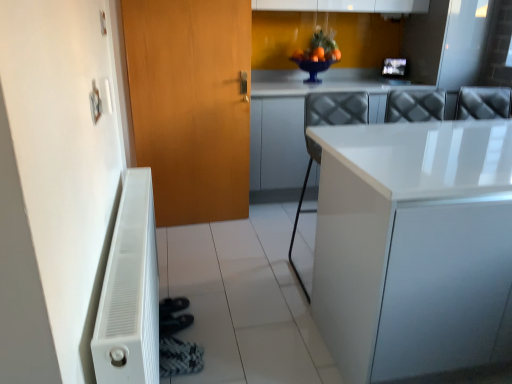
Question: From a real-world perspective, is white glossy countertop at center physically above white matte radiator at lower left?

Choices:
 (A) no
 (B) yes

Answer: (B)

Question: From the image's perspective, is white glossy countertop at center on top of white matte radiator at lower left?

Choices:
 (A) no
 (B) yes

Answer: (B)

Question: Is white glossy countertop at center positioned beyond the bounds of white matte radiator at lower left?

Choices:
 (A) no
 (B) yes

Answer: (B)

Question: Can you confirm if white glossy countertop at center is thinner than white matte radiator at lower left?

Choices:
 (A) yes
 (B) no

Answer: (B)

Question: From a real-world perspective, is white glossy countertop at center located beneath white matte radiator at lower left?

Choices:
 (A) yes
 (B) no

Answer: (B)

Question: Is white glossy countertop at center shorter than white matte radiator at lower left?

Choices:
 (A) yes
 (B) no

Answer: (B)

Question: Considering the relative sizes of white matte radiator at lower left and white glossy chair at center in the image provided, is white matte radiator at lower left bigger than white glossy chair at center?

Choices:
 (A) no
 (B) yes

Answer: (A)

Question: From a real-world perspective, is white matte radiator at lower left on white glossy chair at center?

Choices:
 (A) no
 (B) yes

Answer: (A)

Question: Is white matte radiator at lower left not near white glossy chair at center?

Choices:
 (A) no
 (B) yes

Answer: (A)

Question: Is white matte radiator at lower left with white glossy chair at center?

Choices:
 (A) yes
 (B) no

Answer: (B)

Question: Can you confirm if white matte radiator at lower left is taller than white glossy chair at center?

Choices:
 (A) yes
 (B) no

Answer: (B)

Question: Is white matte radiator at lower left located outside white glossy chair at center?

Choices:
 (A) yes
 (B) no

Answer: (A)

Question: Considering the relative sizes of black textured shoe at lower left and wooden door at left in the image provided, is black textured shoe at lower left taller than wooden door at left?

Choices:
 (A) no
 (B) yes

Answer: (A)